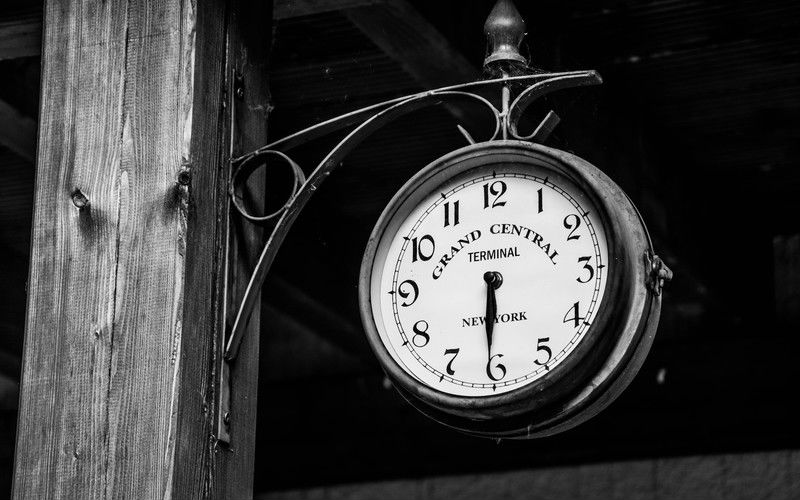
Image resolution: width=800 pixels, height=500 pixels. In order to click on bracket for hanging clock in this screenshot , I will do `click(334, 161)`.